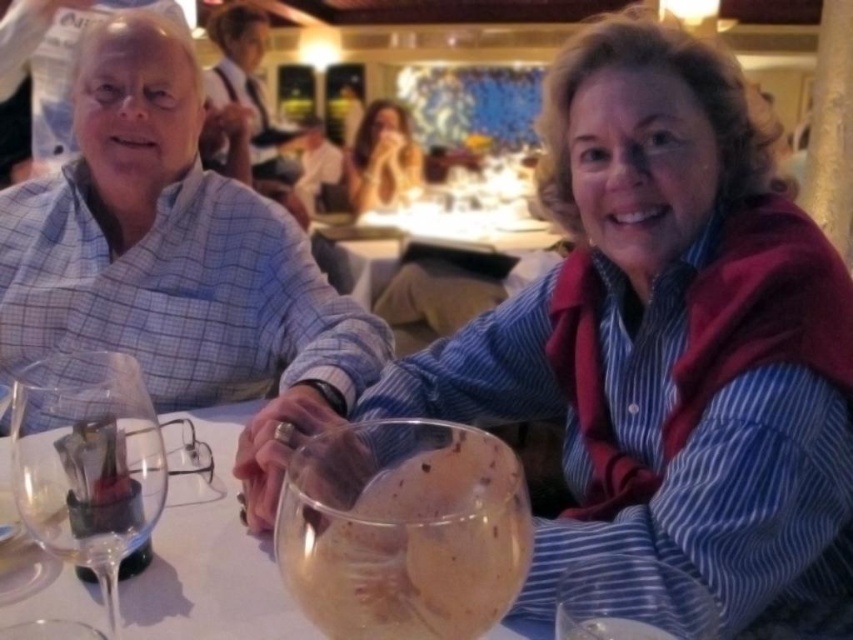
Question: Estimate the real-world distances between objects in this image. Which object is closer to the blonde hair at upper center?

Choices:
 (A) blue striped shirt at center
 (B) light blue plaid shirt at center

Answer: (B)

Question: Is the position of blue striped shirt at center less distant than that of translucent glass bowl at center?

Choices:
 (A) yes
 (B) no

Answer: (B)

Question: Which point is closer to the camera?

Choices:
 (A) (254, 634)
 (B) (373, 140)

Answer: (A)

Question: Which object appears farthest from the camera in this image?

Choices:
 (A) clear glass wine glass at lower left
 (B) blue checkered shirt at left
 (C) blonde hair at upper center

Answer: (C)

Question: Can you confirm if clear glass wine glass at lower left is smaller than blonde hair at upper center?

Choices:
 (A) no
 (B) yes

Answer: (A)

Question: Does blue striped shirt at center appear on the right side of clear glass wine glass at lower left?

Choices:
 (A) no
 (B) yes

Answer: (B)